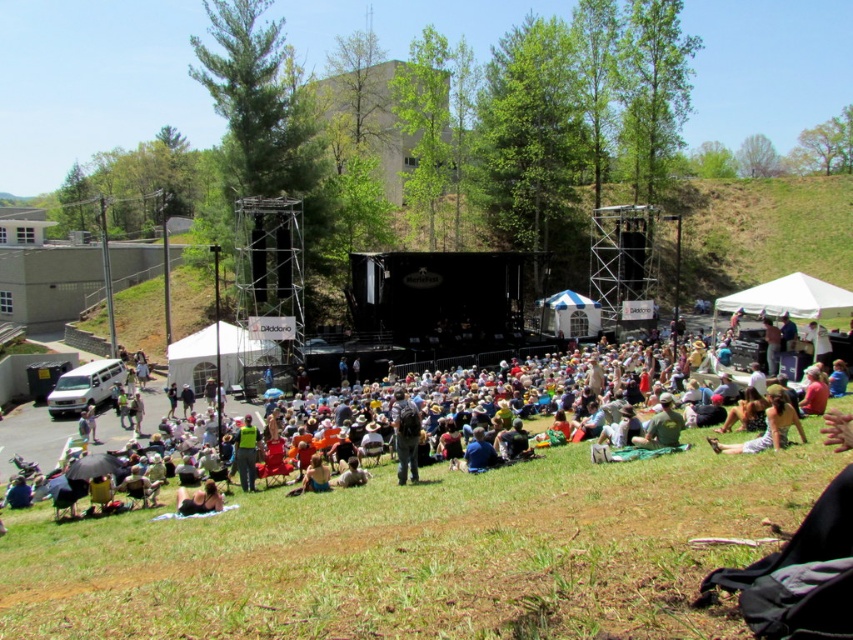
Question: Does green fabric umbrella at center lie in front of blonde hair at lower center?

Choices:
 (A) no
 (B) yes

Answer: (B)

Question: Which object is positioned closest to the blonde hair at lower center?

Choices:
 (A) green fabric blanket at center
 (B) green fabric umbrella at center

Answer: (B)

Question: Can you confirm if green fabric blanket at center is smaller than blonde hair at lower center?

Choices:
 (A) yes
 (B) no

Answer: (B)

Question: Can you confirm if green fabric umbrella at center is positioned above green fabric blanket at center?

Choices:
 (A) no
 (B) yes

Answer: (B)

Question: Which point is farther to the camera?

Choices:
 (A) blonde hair at lower center
 (B) green fabric umbrella at center

Answer: (A)

Question: Which point is farther to the camera?

Choices:
 (A) (189, 513)
 (B) (647, 440)

Answer: (B)